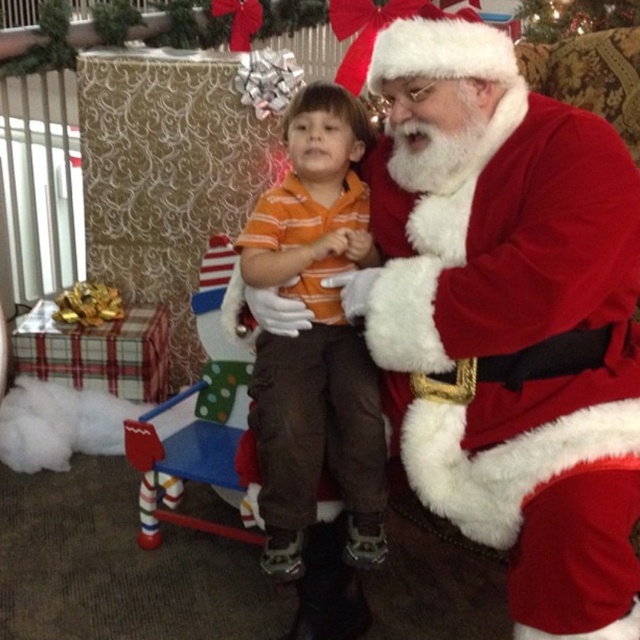
You are a delivery robot 1 meter tall and want to place a gift under the fuzzy red santa at center. Can you reach the area under him?

The distance between fuzzy red santa at center and the viewer is 1.11 meters, so yes, the robot can reach the area under him since it is taller than the distance required.